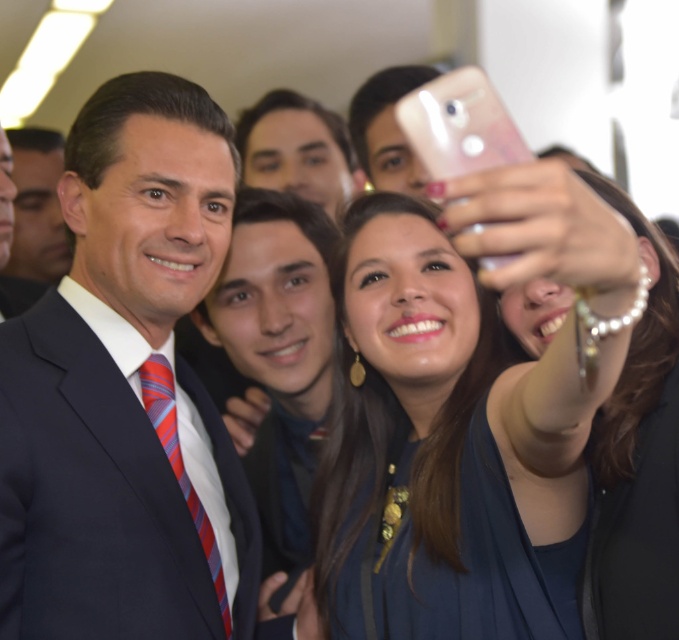
Question: Which object is farther from the camera taking this photo?

Choices:
 (A) matte black suit at center
 (B) blue fabric dress at center

Answer: (A)

Question: Does matte black suit at center have a lesser width compared to blue fabric dress at center?

Choices:
 (A) yes
 (B) no

Answer: (A)

Question: Is matte black suit at center wider than blue fabric dress at center?

Choices:
 (A) yes
 (B) no

Answer: (B)

Question: Can you confirm if matte black suit at center is smaller than blue fabric dress at center?

Choices:
 (A) yes
 (B) no

Answer: (A)